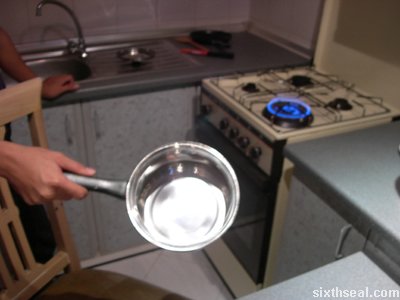
Where is `chair`? chair is located at coordinates (78, 281).